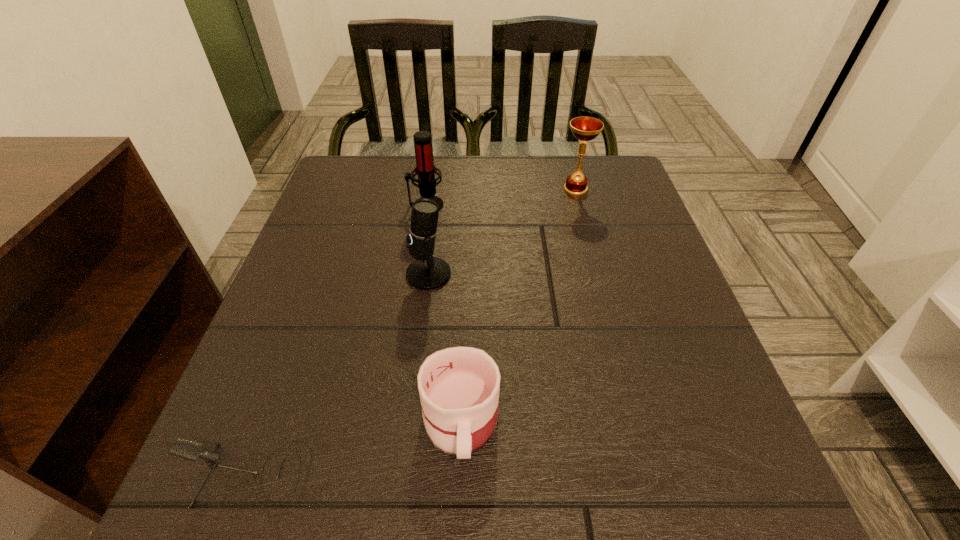
You are a GUI agent. You are given a task and a screenshot of the screen. Output one action in this format:
    pyautogui.click(x=<x>, y=<y>)
    Task: Click on the farthest microphone
    Image resolution: width=960 pixels, height=540 pixels.
    Given the screenshot: What is the action you would take?
    pyautogui.click(x=426, y=171)

Find the location of a particular element. the rightmost object is located at coordinates (583, 128).

The image size is (960, 540). Identify the location of the second nearest microphone. (427, 272).

Identify the location of mug. (459, 387).

You are a GUI agent. You are given a task and a screenshot of the screen. Output one action in this format:
    pyautogui.click(x=<x>, y=<y>)
    Task: Click on the leftmost microphone
    
    Given the screenshot: What is the action you would take?
    pyautogui.click(x=191, y=450)

Find the location of `the nearest microphone`. the nearest microphone is located at coordinates click(x=191, y=450).

The height and width of the screenshot is (540, 960). I want to click on free region located 0.270m on the right of the farthest microphone, so click(553, 205).

Image resolution: width=960 pixels, height=540 pixels. Find the location of `vacant point located 0.110m on the right of the rightmost object`. vacant point located 0.110m on the right of the rightmost object is located at coordinates (633, 189).

Where is `vacant point located on the back of the second farthest microphone`? The height and width of the screenshot is (540, 960). vacant point located on the back of the second farthest microphone is located at coordinates (439, 184).

At what (x,y) coordinates should I click in order to perform the action: click on vacant region located on the stand of the leftmost microphone. Please return your answer as a coordinate pair (x, y). The height and width of the screenshot is (540, 960). Looking at the image, I should click on (435, 476).